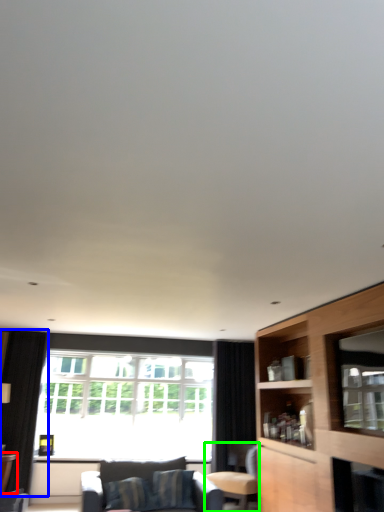
Question: Based on their relative distances, which object is nearer to table (highlighted by a red box)? Choose from curtain (highlighted by a blue box) and chair (highlighted by a green box).

Choices:
 (A) curtain
 (B) chair

Answer: (A)